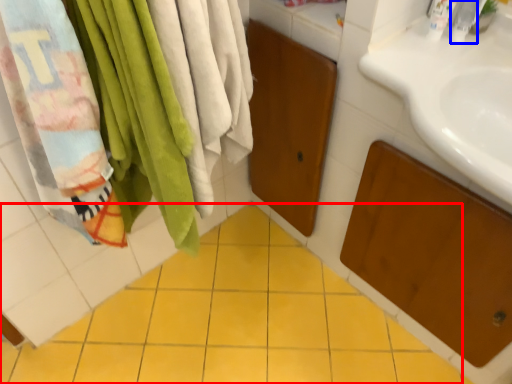
Question: Which of the following is the closest to the observer, ceramic tile (highlighted by a red box) or toiletry (highlighted by a blue box)?

Choices:
 (A) ceramic tile
 (B) toiletry

Answer: (A)